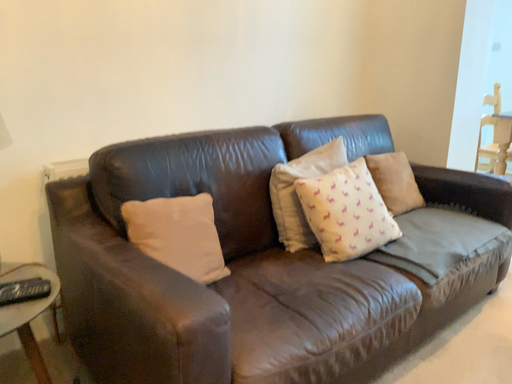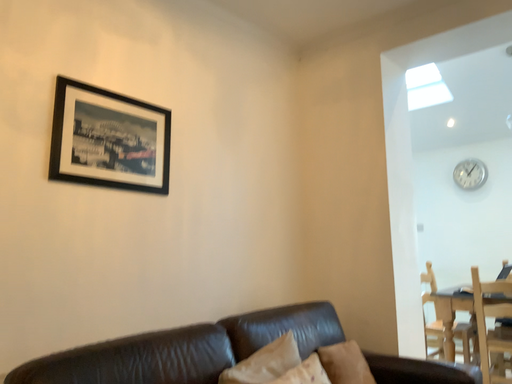
Question: Which way did the camera rotate in the video?

Choices:
 (A) rotated downward
 (B) rotated upward

Answer: (B)